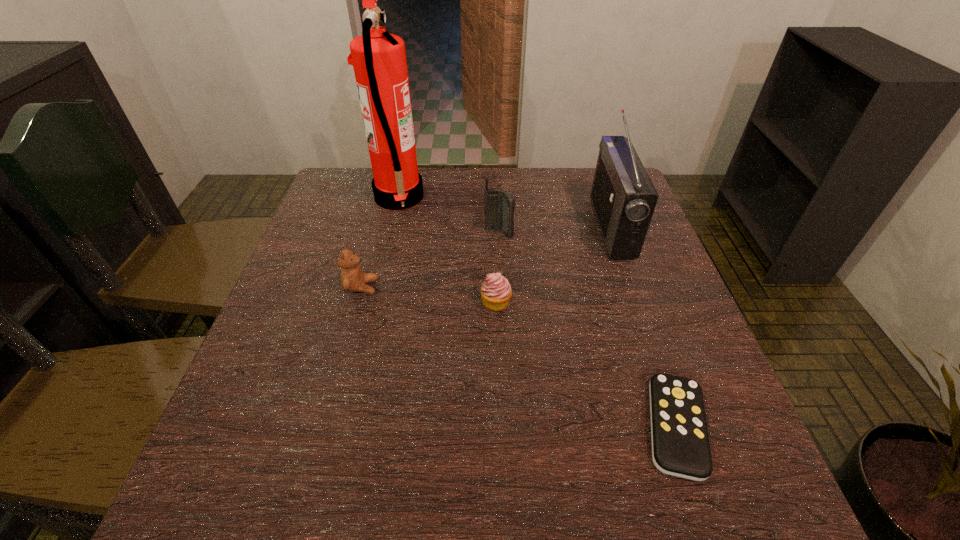
In order to click on free space located 0.120m on the front-facing side of the radio receiver in this screenshot , I will do `click(552, 227)`.

Locate an element on the screen. The height and width of the screenshot is (540, 960). vacant space located on the keyboard of the cellular telephone is located at coordinates (502, 297).

At what (x,y) coordinates should I click in order to perform the action: click on vacant space located 0.230m on the face of the teddy bear. Please return your answer as a coordinate pair (x, y). This screenshot has width=960, height=540. Looking at the image, I should click on [x=479, y=287].

Locate an element on the screen. vacant region located 0.140m on the right of the cupcake is located at coordinates (575, 302).

Where is `vacant space located on the back of the shortest object`? vacant space located on the back of the shortest object is located at coordinates (648, 345).

Locate an element on the screen. The image size is (960, 540). fire extinguisher present at the far edge is located at coordinates (379, 60).

Find the location of a particular element. This screenshot has width=960, height=540. radio receiver at the far edge is located at coordinates (623, 197).

Image resolution: width=960 pixels, height=540 pixels. Identify the location of object at the near edge. (680, 443).

I want to click on fire extinguisher located at the left edge, so point(379,60).

Find the location of `teddy bear located at the left edge`. teddy bear located at the left edge is located at coordinates (352, 278).